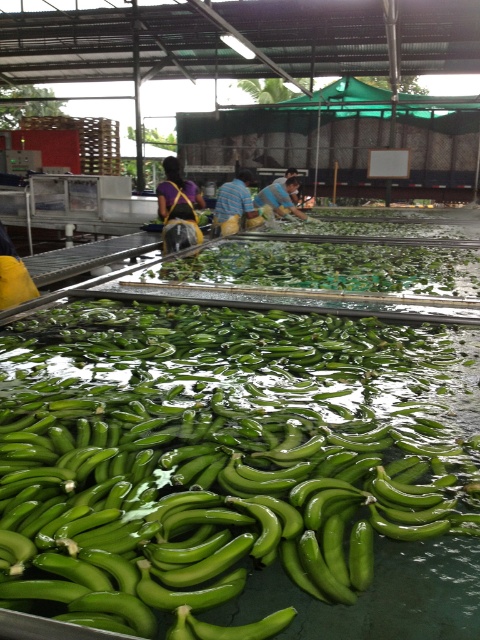
Question: Which object is positioned closest to the yellow fabric bag at center?

Choices:
 (A) striped shirt at center
 (B) green rubbery bananas at center

Answer: (A)

Question: Which object is positioned farthest from the yellow fabric bag at center?

Choices:
 (A) green rubber bananas at center
 (B) striped shirt at center
 (C) green rubbery bananas at center
 (D) blue striped shirt at center

Answer: (A)

Question: Can you confirm if green rubber bananas at center is thinner than striped shirt at center?

Choices:
 (A) no
 (B) yes

Answer: (A)

Question: Does yellow fabric bag at center appear over blue striped shirt at center?

Choices:
 (A) yes
 (B) no

Answer: (B)

Question: Which point is closer to the camera?

Choices:
 (A) blue striped shirt at center
 (B) yellow fabric bag at center

Answer: (B)

Question: Is green rubber bananas at center further to the viewer compared to yellow fabric bag at center?

Choices:
 (A) yes
 (B) no

Answer: (B)